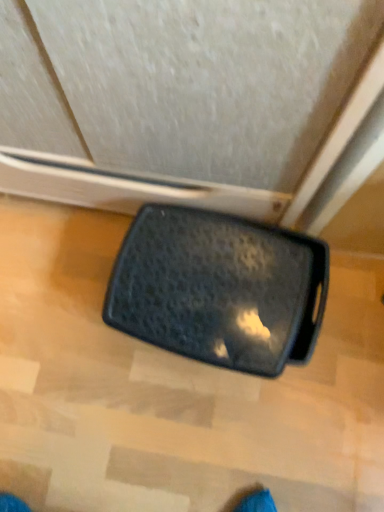
You are a GUI agent. You are given a task and a screenshot of the screen. Output one action in this format:
    pyautogui.click(x=<x>, y=<y>)
    Task: Click on the vacant space in front of black rubber mat at center
    
    Given the screenshot: What is the action you would take?
    pyautogui.click(x=191, y=440)